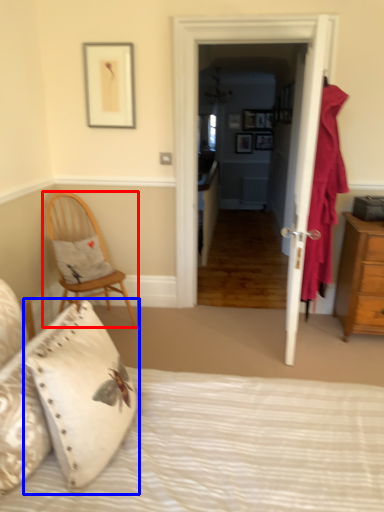
Question: Which object is closer to the camera taking this photo, chair (highlighted by a red box) or pillow (highlighted by a blue box)?

Choices:
 (A) chair
 (B) pillow

Answer: (B)